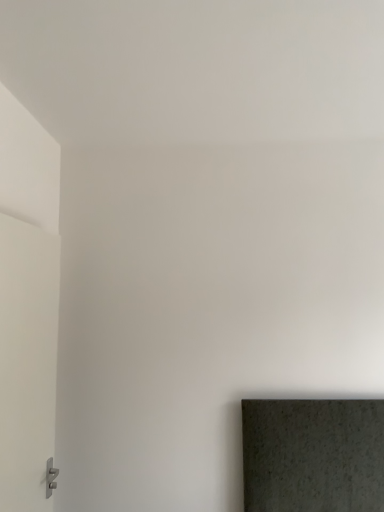
This screenshot has height=512, width=384. In order to click on white matte screen door at left in this screenshot , I will do `click(27, 362)`.

Describe the element at coordinates (27, 362) in the screenshot. I see `white matte screen door at left` at that location.

Locate an element on the screen. The width and height of the screenshot is (384, 512). white matte screen door at left is located at coordinates (27, 362).